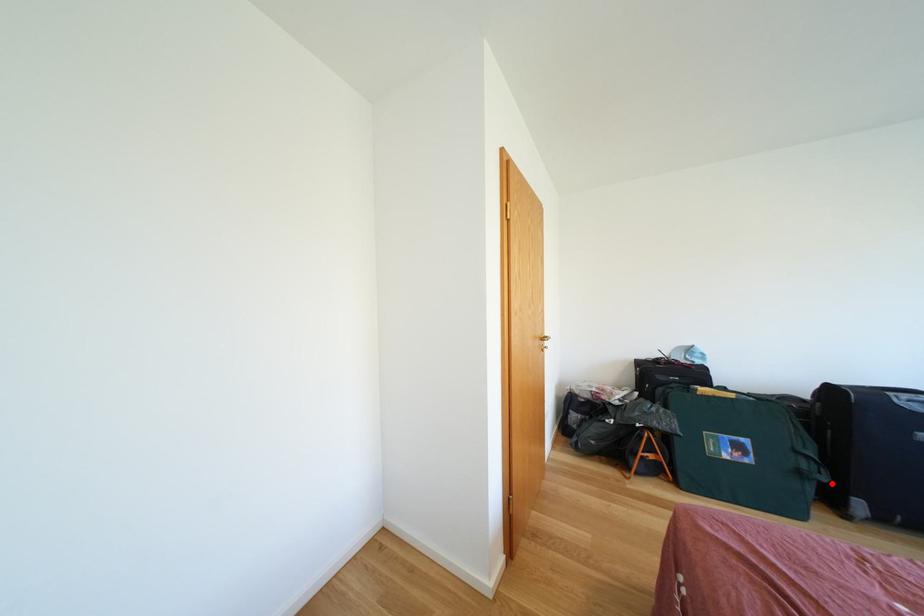
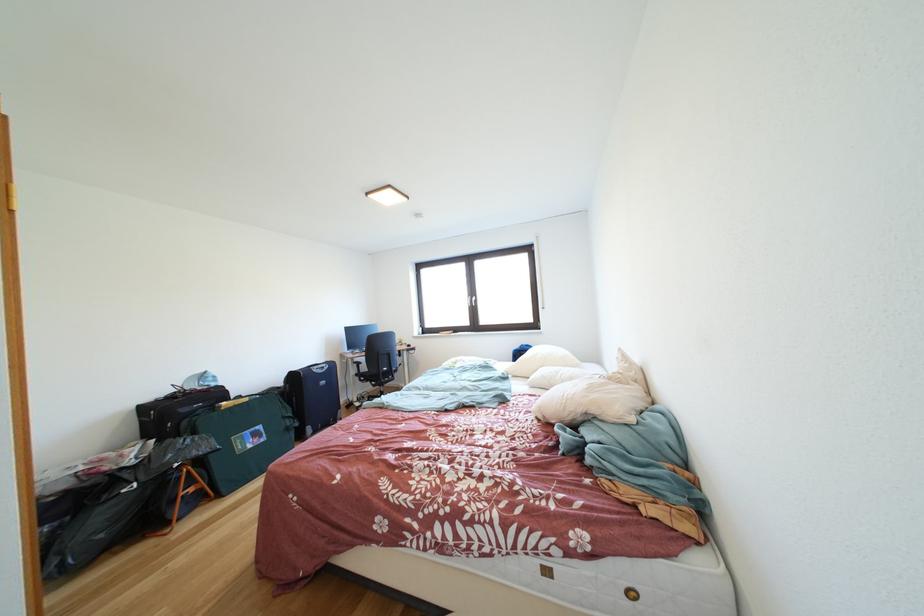
Question: I am providing you with two images of the same scene from different viewpoints. In image1, a red point is highlighted. Considering the same 3D point in image2, which of the following is correct?

Choices:
 (A) It is closer
 (B) It is farther

Answer: (B)